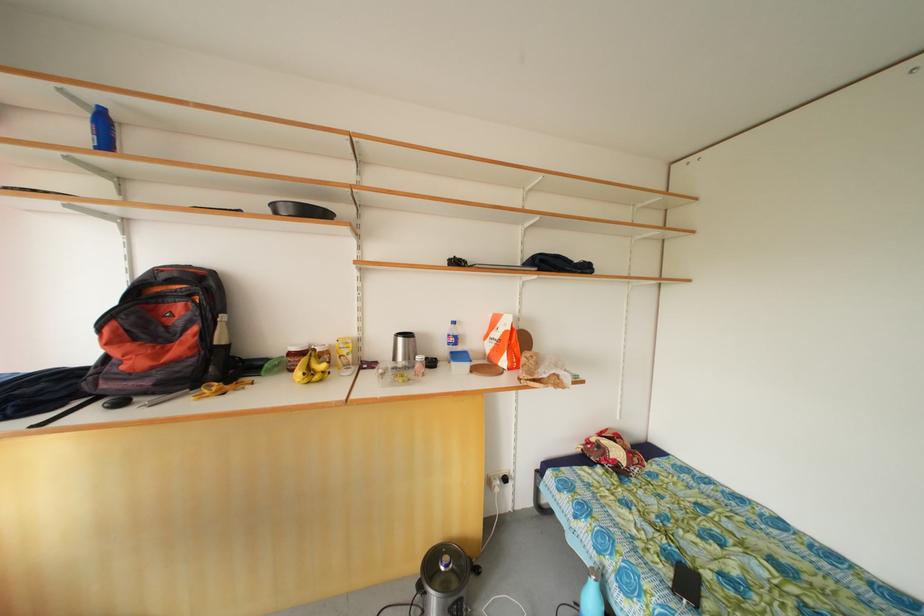
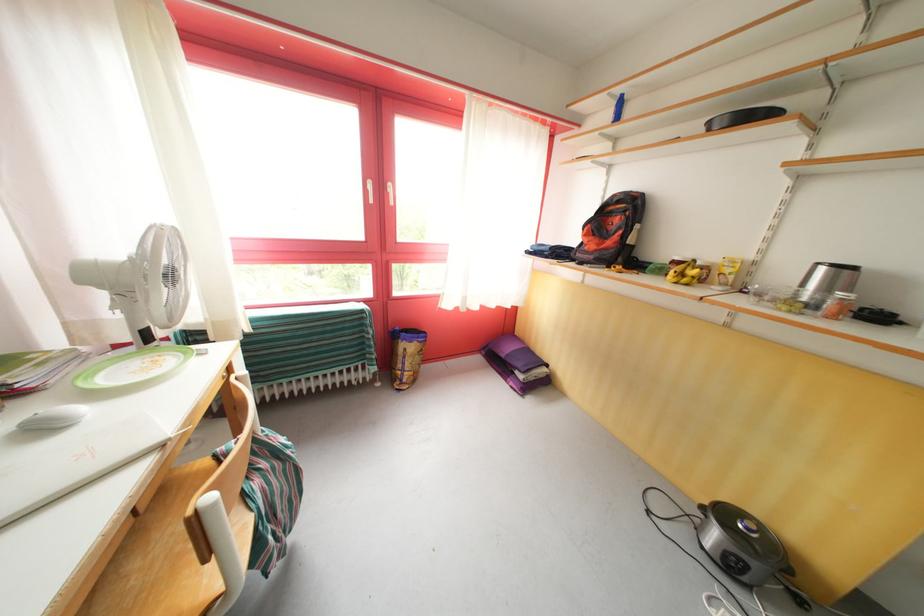
Locate, in the second image, the point that corresponds to point 82,357 in the first image.

(580, 245)